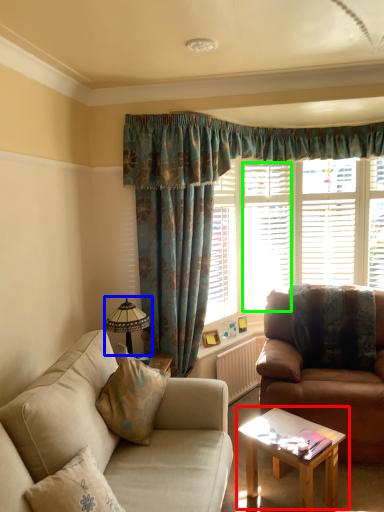
Question: Which is nearer to the coffee table (highlighted by a red box)? lamp (highlighted by a blue box) or shutter (highlighted by a green box).

Choices:
 (A) lamp
 (B) shutter

Answer: (A)